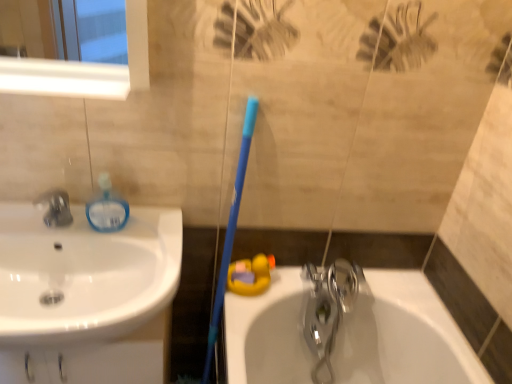
Question: Which direction should I rotate to look at polished chrome faucet at lower center, arranged as the first tap when viewed from the back, — up or down?

Choices:
 (A) up
 (B) down

Answer: (B)

Question: Can we say blue plastic toothbrush at center lies outside polished chrome faucet at lower center, the 2th tap in the front-to-back sequence?

Choices:
 (A) yes
 (B) no

Answer: (A)

Question: Considering the relative sizes of blue plastic toothbrush at center and polished chrome faucet at lower center, arranged as the 1th tap when viewed from the right, in the image provided, is blue plastic toothbrush at center wider than polished chrome faucet at lower center, arranged as the 1th tap when viewed from the right,?

Choices:
 (A) no
 (B) yes

Answer: (B)

Question: From a real-world perspective, is blue plastic toothbrush at center physically above polished chrome faucet at lower center, which is counted as the 2th tap, starting from the left?

Choices:
 (A) yes
 (B) no

Answer: (A)

Question: Is blue plastic toothbrush at center closer to camera compared to polished chrome faucet at lower center, the 1th tap positioned from the bottom?

Choices:
 (A) no
 (B) yes

Answer: (B)

Question: Is polished chrome faucet at lower center, arranged as the 1th tap when viewed from the right, at the back of blue plastic toothbrush at center?

Choices:
 (A) yes
 (B) no

Answer: (B)

Question: Is blue plastic toothbrush at center behind polished chrome faucet at lower center, arranged as the 1th tap when viewed from the right?

Choices:
 (A) no
 (B) yes

Answer: (A)

Question: Does matte black faucet at left, the first tap viewed from the top, have a lesser width compared to polished chrome faucet at lower center, the 1th tap positioned from the bottom?

Choices:
 (A) no
 (B) yes

Answer: (B)

Question: From the image's perspective, would you say matte black faucet at left, the first tap in the front-to-back sequence, is shown under polished chrome faucet at lower center, the 2th tap when ordered from top to bottom?

Choices:
 (A) yes
 (B) no

Answer: (B)

Question: From the image's perspective, is matte black faucet at left, the first tap when ordered from left to right, over polished chrome faucet at lower center, the 2th tap when ordered from top to bottom?

Choices:
 (A) no
 (B) yes

Answer: (B)

Question: Does matte black faucet at left, the first tap when ordered from left to right, have a larger size compared to polished chrome faucet at lower center, the 2th tap when ordered from top to bottom?

Choices:
 (A) yes
 (B) no

Answer: (B)

Question: Is polished chrome faucet at lower center, the 1th tap positioned from the bottom, completely or partially inside matte black faucet at left, the first tap viewed from the top?

Choices:
 (A) yes
 (B) no

Answer: (B)

Question: Does matte black faucet at left, the 2th tap from the back, lie in front of polished chrome faucet at lower center, which is counted as the 2th tap, starting from the left?

Choices:
 (A) no
 (B) yes

Answer: (B)

Question: Does white glossy sink at left have a greater height compared to polished chrome faucet at lower center, which is counted as the 2th tap, starting from the left?

Choices:
 (A) yes
 (B) no

Answer: (B)